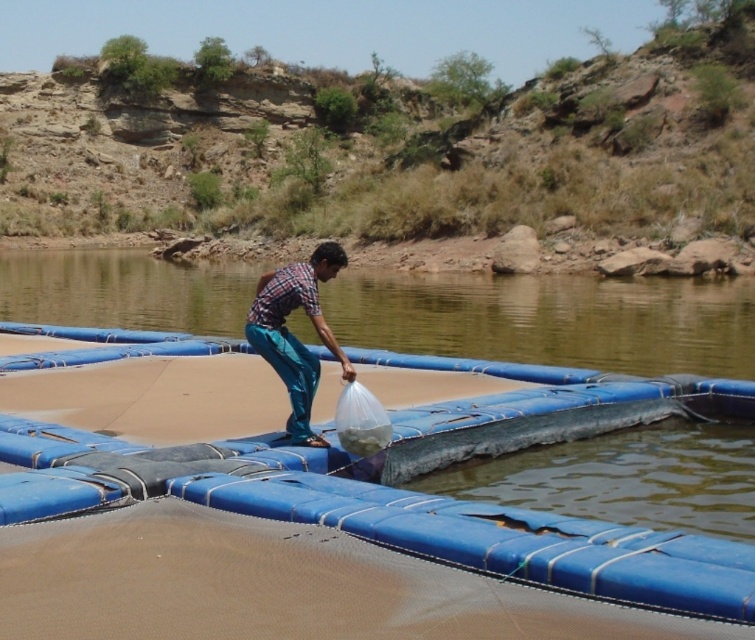
Measure the distance between blue rubber raft at center and camera.

blue rubber raft at center and camera are 10.55 meters apart from each other.

Is blue rubber raft at center to the right of plaid shirt at center from the viewer's perspective?

Incorrect, blue rubber raft at center is not on the right side of plaid shirt at center.

Does point (207, 321) come closer to viewer compared to point (260, 308)?

No, it is not.

The width and height of the screenshot is (755, 640). I want to click on blue rubber raft at center, so coord(552,320).